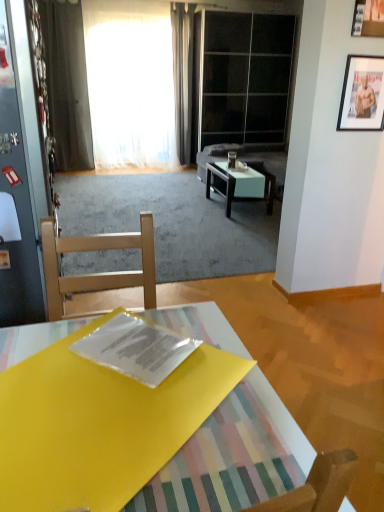
Locate an element on the screen. This screenshot has height=512, width=384. unoccupied region to the right of transparent plastic magazine at center is located at coordinates (220, 347).